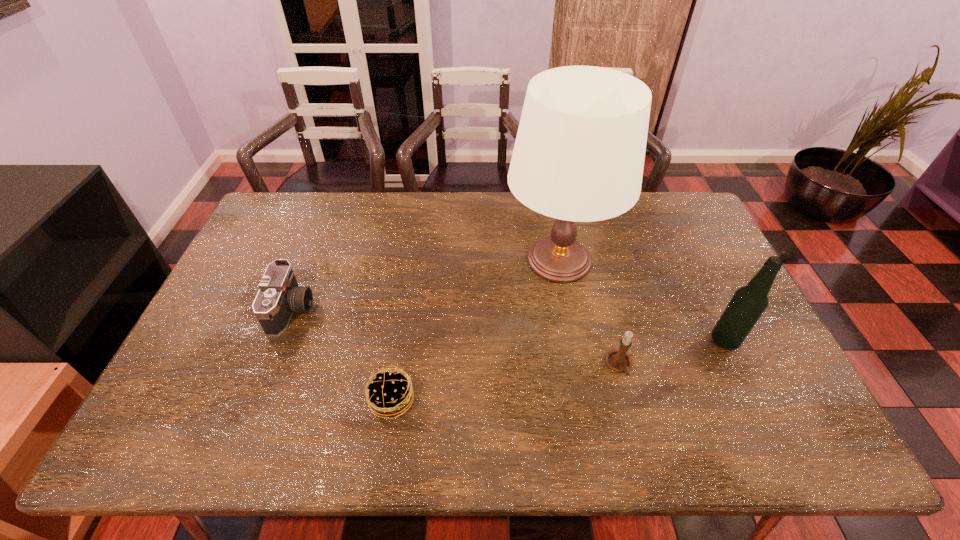
Where is `lamp`? The image size is (960, 540). lamp is located at coordinates (579, 154).

At what (x,y) coordinates should I click in order to perform the action: click on the fourth shortest object. Please return your answer as a coordinate pair (x, y). Looking at the image, I should click on point(749,302).

Where is `the rightmost object`? This screenshot has width=960, height=540. the rightmost object is located at coordinates (749, 302).

This screenshot has height=540, width=960. Find the location of `candle holder`. candle holder is located at coordinates (618, 360).

This screenshot has width=960, height=540. Find the location of `the leftmost object`. the leftmost object is located at coordinates (279, 295).

I want to click on the second shortest object, so click(279, 295).

You are a GUI agent. You are given a task and a screenshot of the screen. Output one action in this format:
    pyautogui.click(x=<x>, y=<y>)
    Task: Click on the second object from left to right
    
    Given the screenshot: What is the action you would take?
    pyautogui.click(x=388, y=393)

Locate an element on the screen. Image resolution: width=960 pixels, height=540 pixels. the shortest object is located at coordinates (388, 393).

Identify the location of free point located on the left of the tallest object. This screenshot has width=960, height=540. (395, 260).

Where is `free region located on the front of the fourth shortest object`? The image size is (960, 540). free region located on the front of the fourth shortest object is located at coordinates (742, 379).